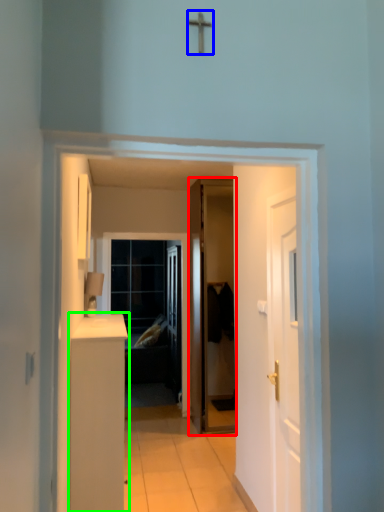
Question: Which object is the closest to the door (highlighted by a red box)? Choose among these: crucifix (highlighted by a blue box) or cabinetry (highlighted by a green box).

Choices:
 (A) crucifix
 (B) cabinetry

Answer: (B)